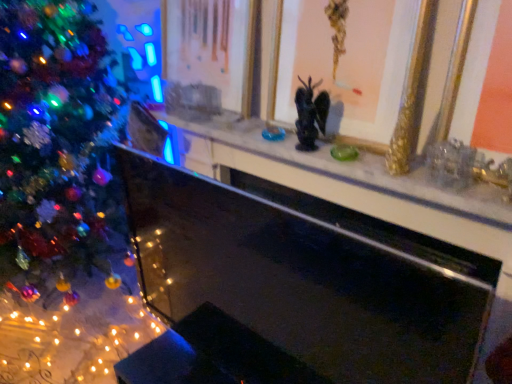
Question: Is gold/gilded picture frame at upper center, the second picture frame when ordered from right to left, bigger than black glass fireplace at center?

Choices:
 (A) no
 (B) yes

Answer: (A)

Question: Is gold/gilded picture frame at upper center, the second picture frame when ordered from right to left, behind black glass fireplace at center?

Choices:
 (A) no
 (B) yes

Answer: (B)

Question: Does gold/gilded picture frame at upper center, the first picture frame when ordered from left to right, have a lesser height compared to black glass fireplace at center?

Choices:
 (A) no
 (B) yes

Answer: (B)

Question: Can you confirm if gold/gilded picture frame at upper center, the first picture frame when ordered from left to right, is smaller than black glass fireplace at center?

Choices:
 (A) yes
 (B) no

Answer: (A)

Question: Is gold/gilded picture frame at upper center, the second picture frame when ordered from right to left, not inside black glass fireplace at center?

Choices:
 (A) no
 (B) yes

Answer: (B)

Question: In terms of width, does shiny multicolored ornaments at left look wider or thinner when compared to marble mantel at center?

Choices:
 (A) thin
 (B) wide

Answer: (B)

Question: Considering the positions of point (11, 3) and point (182, 122), is point (11, 3) closer or farther from the camera than point (182, 122)?

Choices:
 (A) farther
 (B) closer

Answer: (A)

Question: In terms of height, does shiny multicolored ornaments at left look taller or shorter compared to marble mantel at center?

Choices:
 (A) tall
 (B) short

Answer: (A)

Question: From the image's perspective, relative to marble mantel at center, is shiny multicolored ornaments at left above or below?

Choices:
 (A) below
 (B) above

Answer: (A)

Question: From their relative heights in the image, would you say gold/gilded picture frame at upper center, the second picture frame when ordered from right to left, is taller or shorter than black glass fireplace at center?

Choices:
 (A) tall
 (B) short

Answer: (B)

Question: Is gold/gilded picture frame at upper center, the first picture frame when ordered from left to right, inside the boundaries of black glass fireplace at center, or outside?

Choices:
 (A) outside
 (B) inside

Answer: (A)

Question: Is point (244, 38) closer or farther from the camera than point (293, 263)?

Choices:
 (A) farther
 (B) closer

Answer: (A)

Question: Considering the positions of gold/gilded picture frame at upper center, the second picture frame when ordered from right to left, and black glass fireplace at center in the image, is gold/gilded picture frame at upper center, the second picture frame when ordered from right to left, bigger or smaller than black glass fireplace at center?

Choices:
 (A) big
 (B) small

Answer: (B)

Question: Considering the positions of gold/golden picture frame at upper center, the second picture frame viewed from the left, and black glass fireplace at center in the image, is gold/golden picture frame at upper center, the second picture frame viewed from the left, taller or shorter than black glass fireplace at center?

Choices:
 (A) tall
 (B) short

Answer: (B)

Question: Is point (358, 110) closer or farther from the camera than point (338, 375)?

Choices:
 (A) farther
 (B) closer

Answer: (A)